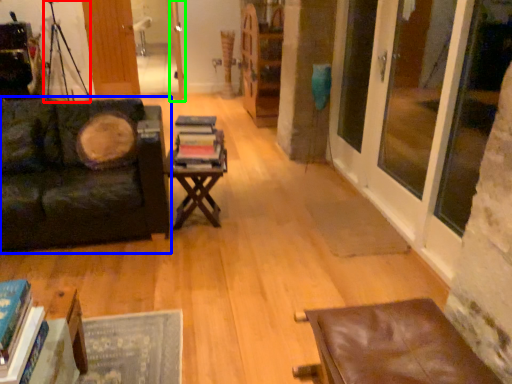
Question: Which object is positioned farthest from tripod (highlighted by a red box)? Select from studio couch (highlighted by a blue box) and door (highlighted by a green box).

Choices:
 (A) studio couch
 (B) door

Answer: (A)